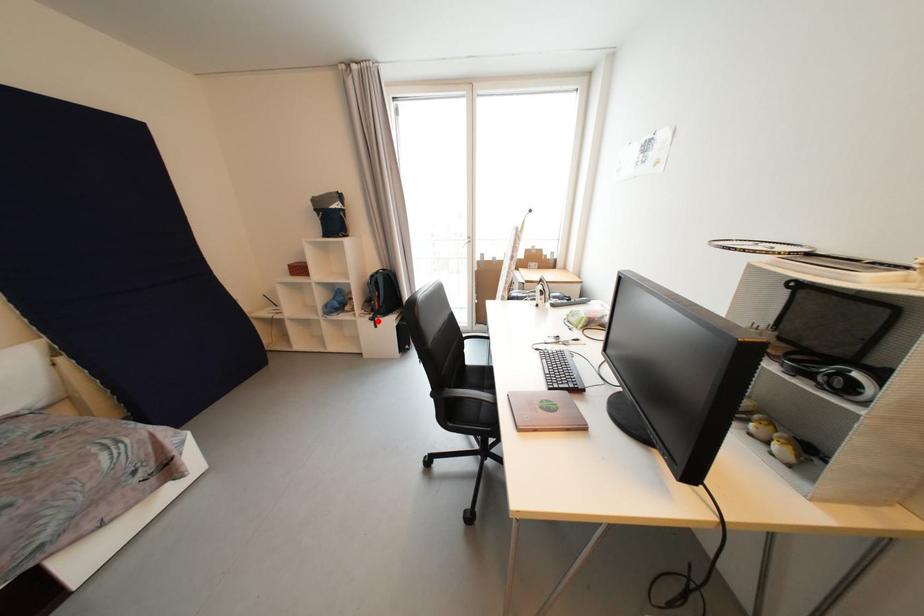
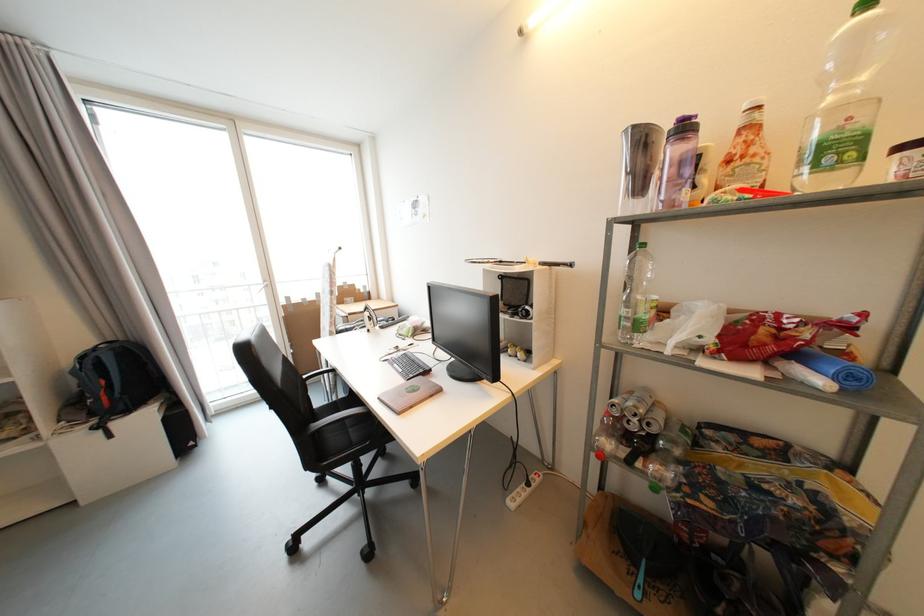
Find the pixel in the second image that matches the highlighted location in the first image.

(104, 429)